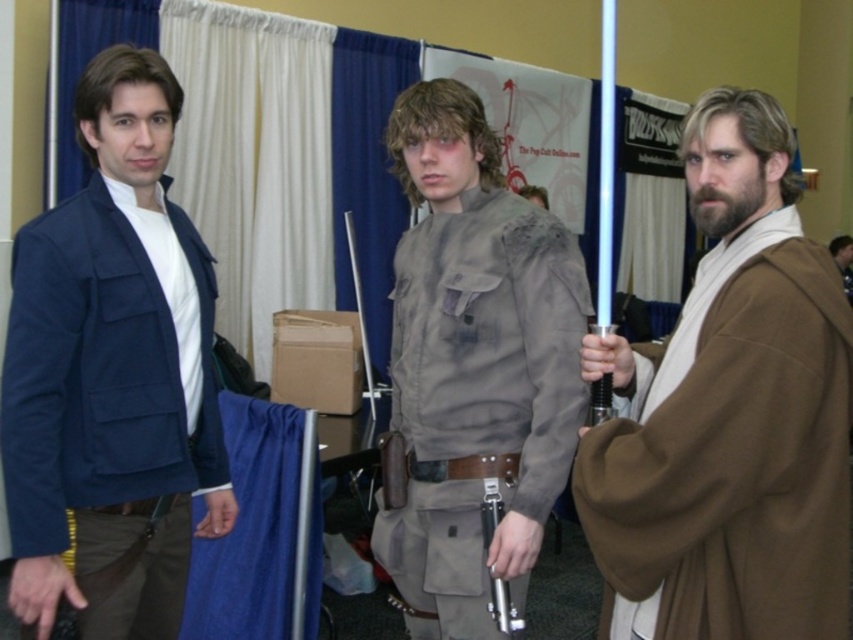
Can you confirm if brown cloth robe at right is positioned above gray fabric shirt at center?

Yes.

This screenshot has width=853, height=640. I want to click on brown cloth robe at right, so click(728, 413).

Is brown cloth robe at right smaller than matte blue jacket at left?

Actually, brown cloth robe at right might be larger than matte blue jacket at left.

Does point (798, 506) come farther from viewer compared to point (177, 486)?

No, (798, 506) is in front of (177, 486).

Describe the element at coordinates (728, 413) in the screenshot. The height and width of the screenshot is (640, 853). I see `brown cloth robe at right` at that location.

You are a GUI agent. You are given a task and a screenshot of the screen. Output one action in this format:
    pyautogui.click(x=<x>, y=<y>)
    Task: Click on the brown cloth robe at right
    The width and height of the screenshot is (853, 640).
    Given the screenshot: What is the action you would take?
    pyautogui.click(x=728, y=413)

Can you confirm if gray fabric shirt at center is positioned above metallic silver lightsaber at center?

Indeed, gray fabric shirt at center is positioned over metallic silver lightsaber at center.

This screenshot has height=640, width=853. I want to click on gray fabric shirt at center, so click(x=473, y=365).

Image resolution: width=853 pixels, height=640 pixels. I want to click on gray fabric shirt at center, so click(x=473, y=365).